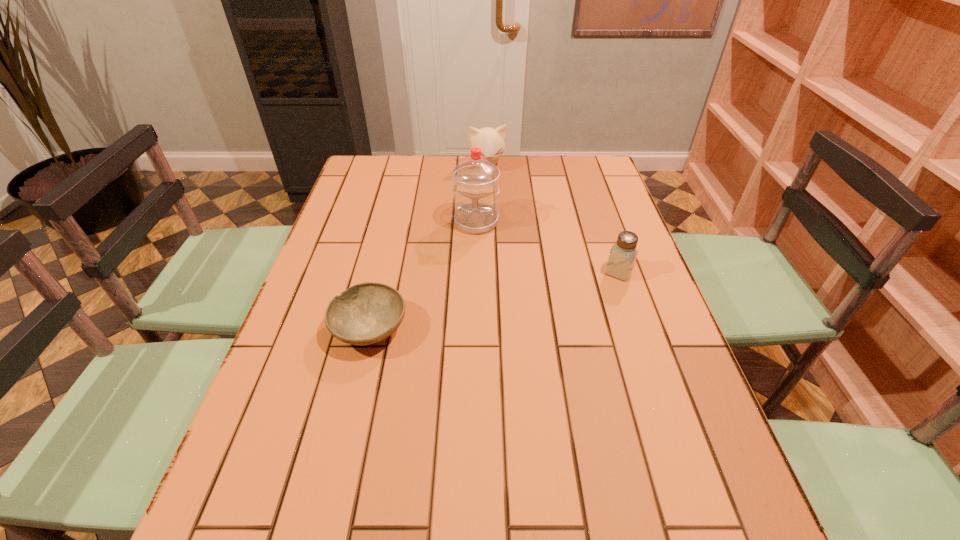
I want to click on free spot at the left edge of the desktop, so click(269, 374).

This screenshot has height=540, width=960. Identify the location of vacant space at the right edge of the desktop. (679, 362).

Identify the location of free space at the far right corner of the desktop. (567, 163).

You are a GUI agent. You are given a task and a screenshot of the screen. Output one action in this format:
    pyautogui.click(x=<x>, y=<y>)
    Task: Click on the free space at the near right corner of the desktop
    This screenshot has height=540, width=960.
    Given the screenshot: What is the action you would take?
    pyautogui.click(x=686, y=478)

At what (x,y) coordinates should I click in order to perform the action: click on free space that is in between the water bottle and the bowl. Please return your answer as a coordinate pair (x, y). This screenshot has height=540, width=960. Looking at the image, I should click on (423, 275).

I want to click on free space between the tallest object and the third farthest object, so click(x=547, y=247).

The height and width of the screenshot is (540, 960). Find the location of `free space between the nearest object and the third shortest object`. free space between the nearest object and the third shortest object is located at coordinates pyautogui.click(x=428, y=248).

I want to click on free space between the bowl and the third tallest object, so click(x=494, y=300).

Locate an element on the screen. vacant point located between the rightmost object and the farthest object is located at coordinates (553, 219).

Locate an element on the screen. empty location between the nearest object and the third tallest object is located at coordinates (494, 300).